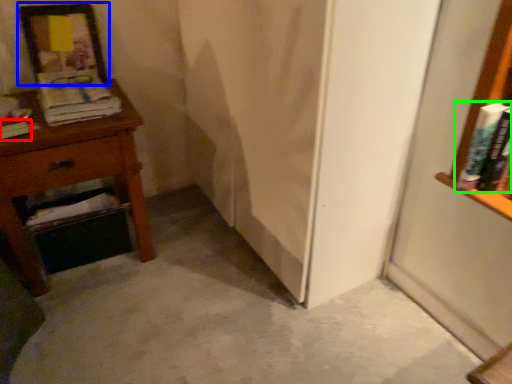
Question: Considering the real-world distances, which object is closest to book (highlighted by a red box)? picture frame (highlighted by a blue box) or book (highlighted by a green box).

Choices:
 (A) picture frame
 (B) book

Answer: (A)